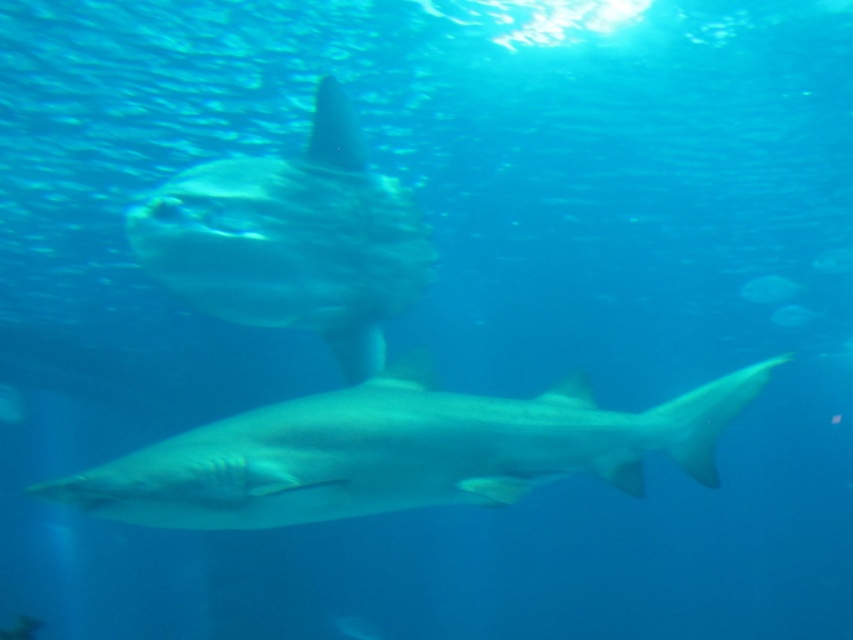
You are an aquarium guide explaining the aquarium layout to a visitor. You point out the translucent white shark at center and the translucent white fish at center. Which one has a wider body?

The translucent white shark at center has a wider body than the translucent white fish at center according to the description.

Consider the image. You are an aquarium guide explaining the underwater scene to visitors. You point out the smooth gray shark at center and the translucent white shark at center. Which of these two sharks is located below the other?

The smooth gray shark at center is positioned under the translucent white shark at center, so it is located below the other.

You are an underwater photographer aiming to capture a shot of both the translucent white shark at center and the translucent white fish at center. Since you want to ensure both are in focus, which one should you focus on first, the one closer to you or the one further away?

The translucent white shark at center is located above the translucent white fish at center. Since in underwater photography, focusing on the closer subject first ensures both can be in focus, you should focus on the translucent white shark at center first as it is closer to you.